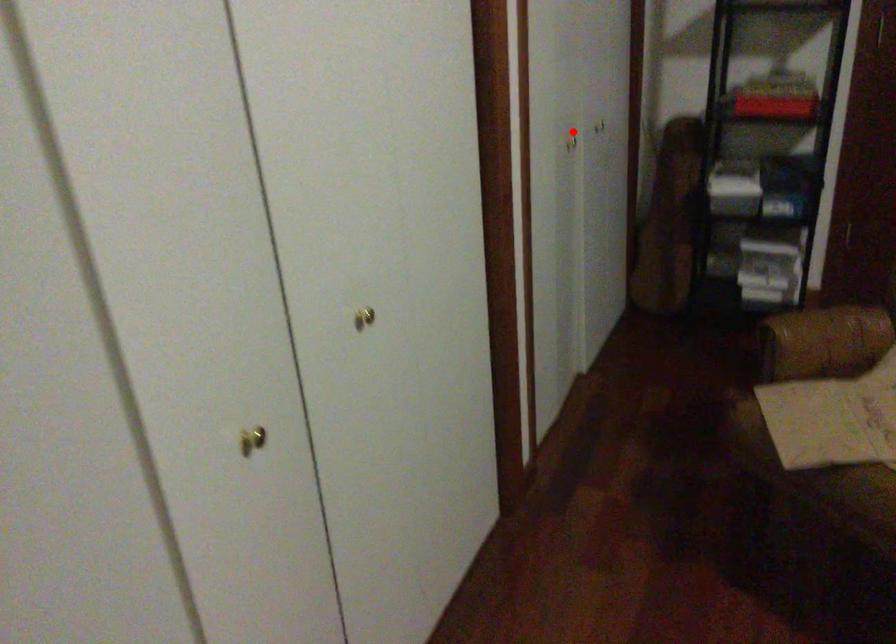
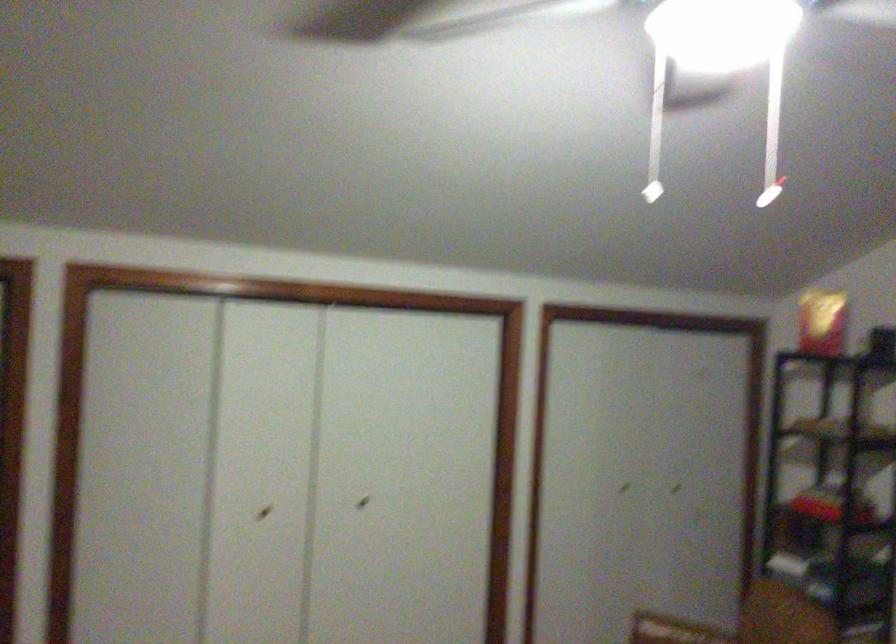
Question: A red point is marked in image1. In image2, is the corresponding 3D point closer to the camera or farther? Reply with the corresponding letter.

Choices:
 (A) The corresponding 3D point is closer.
 (B) The corresponding 3D point is farther.

Answer: (B)